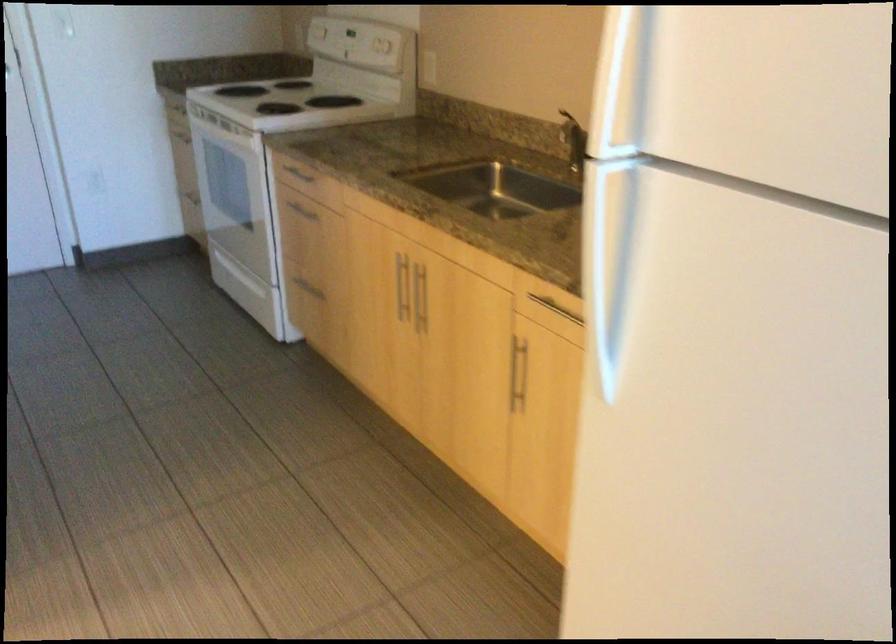
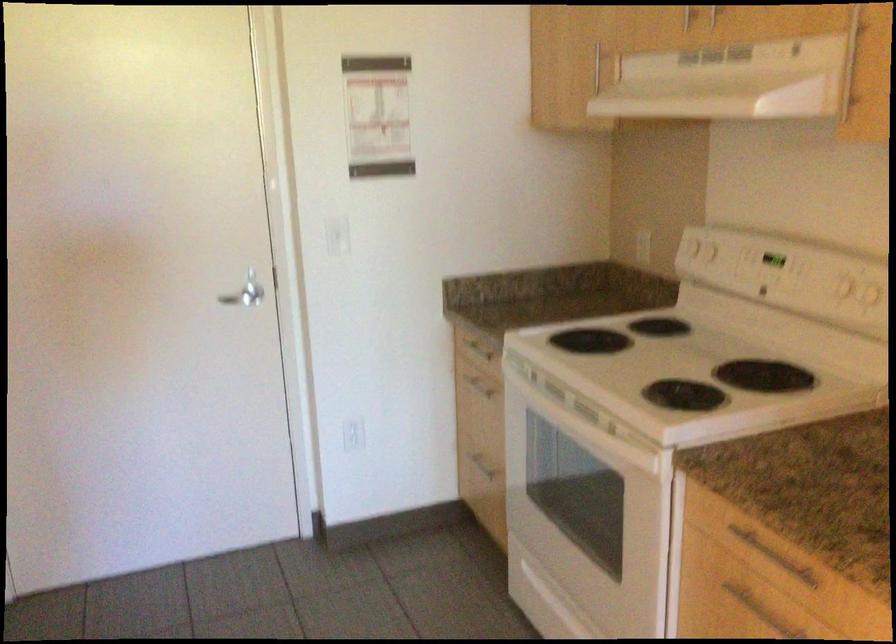
In the second image, find the point that corresponds to [291,102] in the first image.

(686, 365)